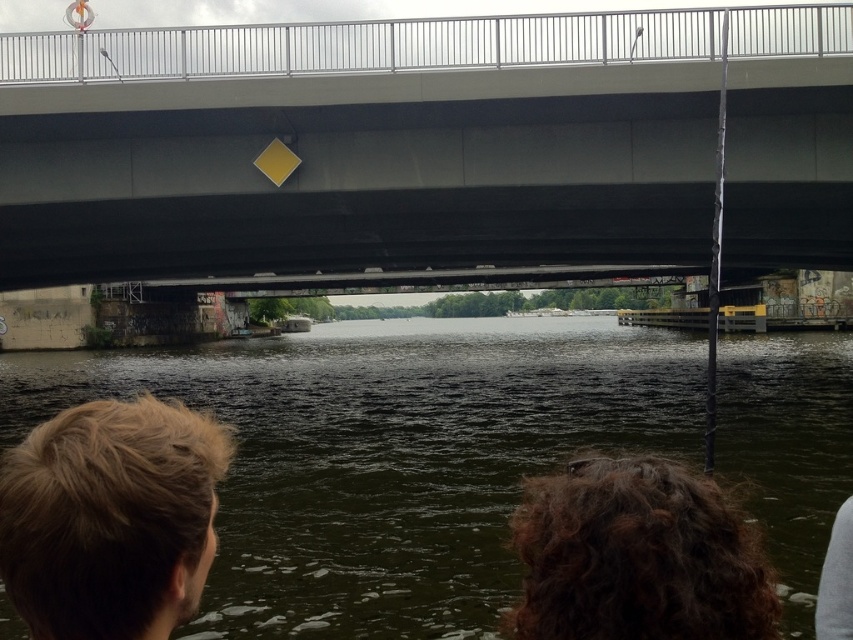
From the picture: Is smooth concrete bridge at center to the left of dark brown curly hair at lower center from the viewer's perspective?

Indeed, smooth concrete bridge at center is positioned on the left side of dark brown curly hair at lower center.

Which is above, smooth concrete bridge at center or dark brown curly hair at lower center?

smooth concrete bridge at center is higher up.

Is point (131, 216) positioned behind point (663, 561)?

Yes, it is.

The width and height of the screenshot is (853, 640). What are the coordinates of `smooth concrete bridge at center` in the screenshot? It's located at (358, 168).

Who is shorter, blonde hair at lower left or gray fabric at lower right?

gray fabric at lower right is shorter.

This screenshot has height=640, width=853. What do you see at coordinates (111, 518) in the screenshot? I see `blonde hair at lower left` at bounding box center [111, 518].

The image size is (853, 640). What do you see at coordinates (111, 518) in the screenshot?
I see `blonde hair at lower left` at bounding box center [111, 518].

This screenshot has width=853, height=640. Find the location of `blonde hair at lower left`. blonde hair at lower left is located at coordinates (111, 518).

Between smooth concrete bridge at center and gray fabric at lower right, which one is positioned higher?

smooth concrete bridge at center is higher up.

Can you confirm if smooth concrete bridge at center is bigger than gray fabric at lower right?

Indeed, smooth concrete bridge at center has a larger size compared to gray fabric at lower right.

Is point (577, 250) positioned in front of point (830, 561)?

No, (577, 250) is further to viewer.

What are the coordinates of `smooth concrete bridge at center` in the screenshot? It's located at (358, 168).